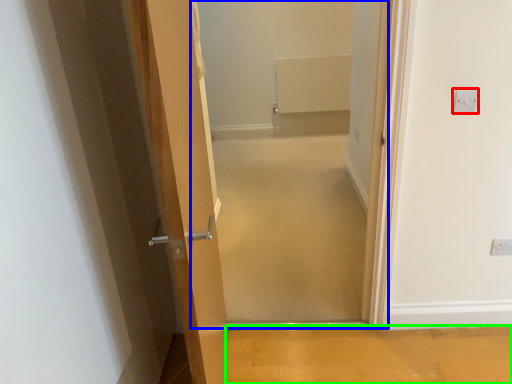
Question: Considering the real-world distances, which object is closest to electric outlet (highlighted by a red box)? corridor (highlighted by a blue box) or plain (highlighted by a green box).

Choices:
 (A) corridor
 (B) plain

Answer: (B)